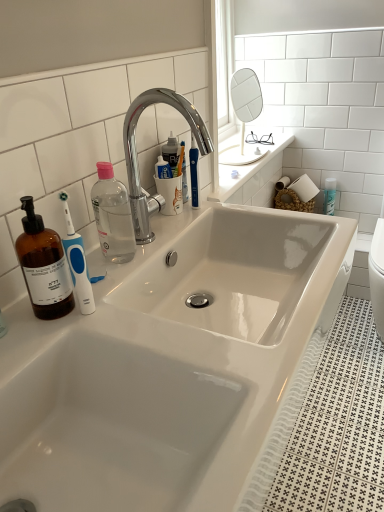
Locate an element on the screen. The width and height of the screenshot is (384, 512). vacant space in white glossy mirror at upper center (from a real-world perspective) is located at coordinates (244, 157).